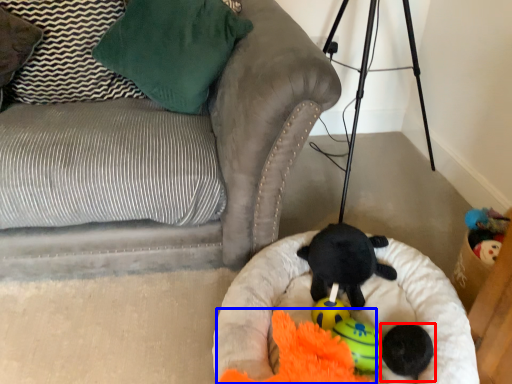
Question: Among these objects, which one is nearest to the camera, toy (highlighted by a red box) or toy (highlighted by a blue box)?

Choices:
 (A) toy
 (B) toy

Answer: (B)